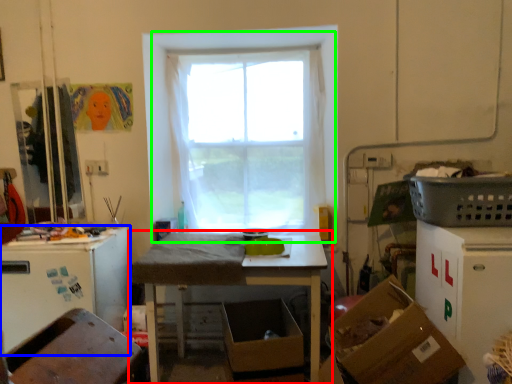
Question: Which is nearer to the table (highlighted by a red box)? leftover (highlighted by a blue box) or window (highlighted by a green box).

Choices:
 (A) leftover
 (B) window

Answer: (A)